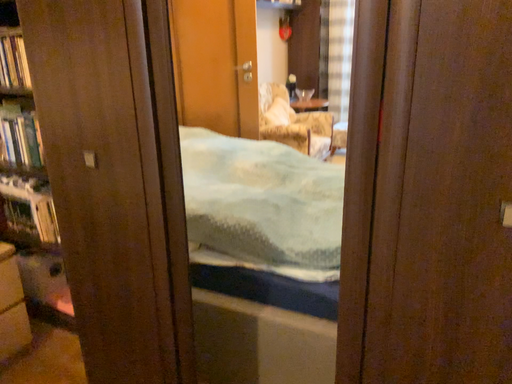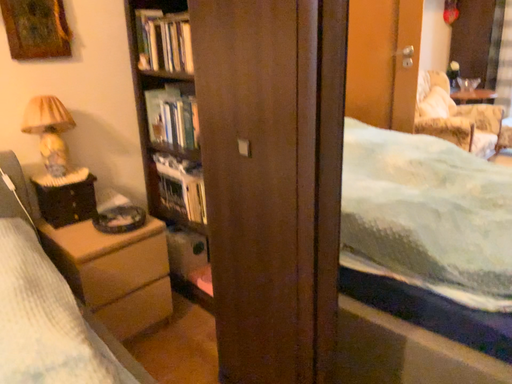
Question: How did the camera likely rotate when shooting the video?

Choices:
 (A) rotated left
 (B) rotated right

Answer: (A)